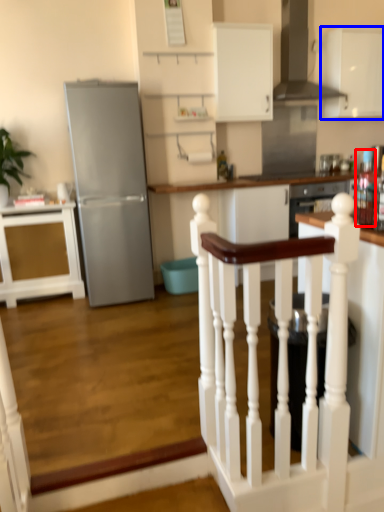
Question: Which object appears farthest to the camera in this image, appliance (highlighted by a red box) or cabinetry (highlighted by a blue box)?

Choices:
 (A) appliance
 (B) cabinetry

Answer: (B)